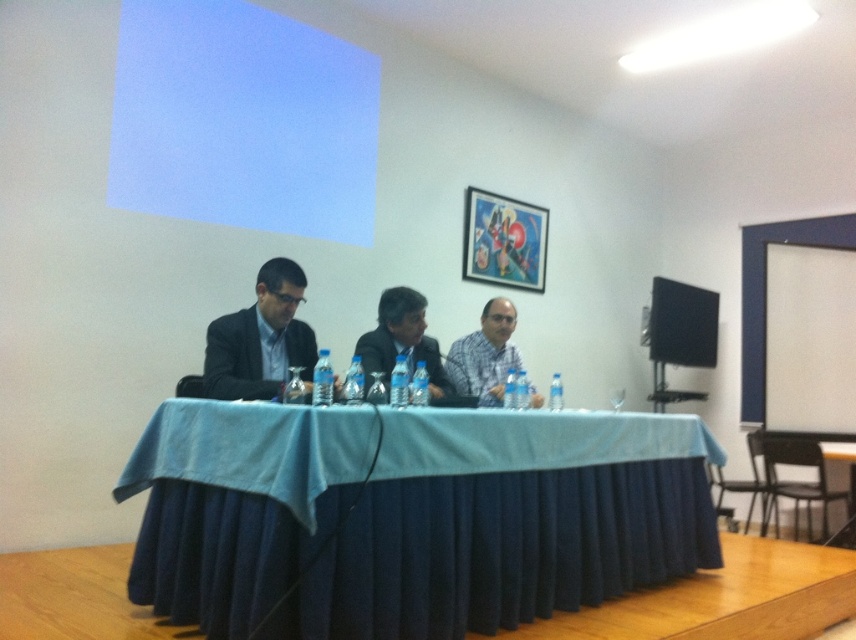
You are a photographer setting up for an event. You need to position a light source so that it illuminates both the white glossy projection screen at upper center and the matte black suit at left without causing glare on either surface. Considering their positions, which object should be placed closer to the light source to achieve this?

The matte black suit at left should be placed closer to the light source because it is behind the white glossy projection screen at upper center, allowing the light to reach both surfaces effectively while minimizing glare on the glossy screen.

You are a photographer setting up for a group photo in the conference room. You need to position a light source so it illuminates both the white glossy projection screen at upper center and the matte black suit at left without causing glare on either surface. Based on their positions, where should you place the light source relative to the camera?

The white glossy projection screen at upper center is located above the matte black suit at left. To avoid glare on both surfaces, the light source should be positioned to the side and slightly behind the camera, angled downward to illuminate the screen and the suit evenly while minimizing reflections.

You are a photographer setting up for a group photo in the conference room. You need to position a tripod between the black plastic speaker at right and the white shirt at center so that it doesn

The black plastic speaker at right is positioned over the white shirt at center, so placing the tripod between them would require positioning it directly below the speaker and above the shirt to avoid obstruction.